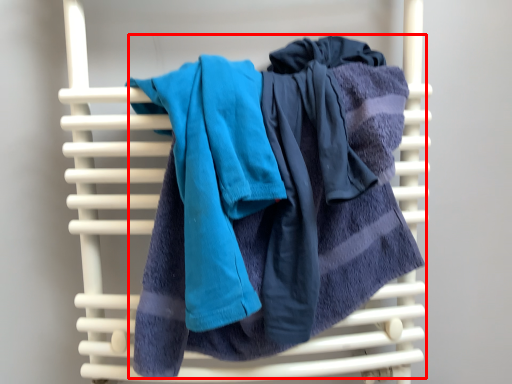
Question: From the image's perspective, what is the correct spatial relationship of towel (annotated by the red box) in relation to towel?

Choices:
 (A) below
 (B) above

Answer: (A)